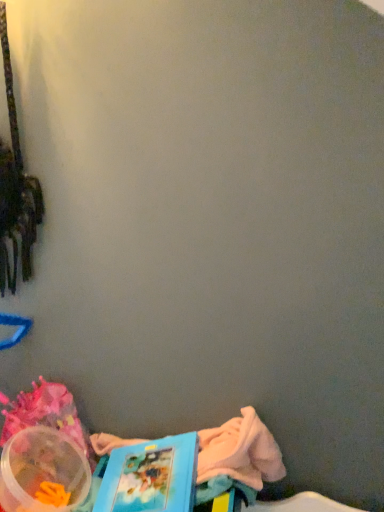
Question: From a real-world perspective, is translucent plastic container at lower left positioned above or below blue cardboard book at lower left?

Choices:
 (A) above
 (B) below

Answer: (B)

Question: From the image's perspective, is translucent plastic container at lower left located above or below blue cardboard book at lower left?

Choices:
 (A) below
 (B) above

Answer: (A)

Question: Is translucent plastic container at lower left spatially inside blue cardboard book at lower left, or outside of it?

Choices:
 (A) outside
 (B) inside

Answer: (A)

Question: In the image, is blue cardboard book at lower left on the left side or the right side of translucent plastic container at lower left?

Choices:
 (A) left
 (B) right

Answer: (B)

Question: Is blue cardboard book at lower left in front of or behind translucent plastic container at lower left in the image?

Choices:
 (A) front
 (B) behind

Answer: (A)

Question: Is blue cardboard book at lower left inside or outside of translucent plastic container at lower left?

Choices:
 (A) outside
 (B) inside

Answer: (A)

Question: In terms of size, does blue cardboard book at lower left appear bigger or smaller than translucent plastic container at lower left?

Choices:
 (A) big
 (B) small

Answer: (A)